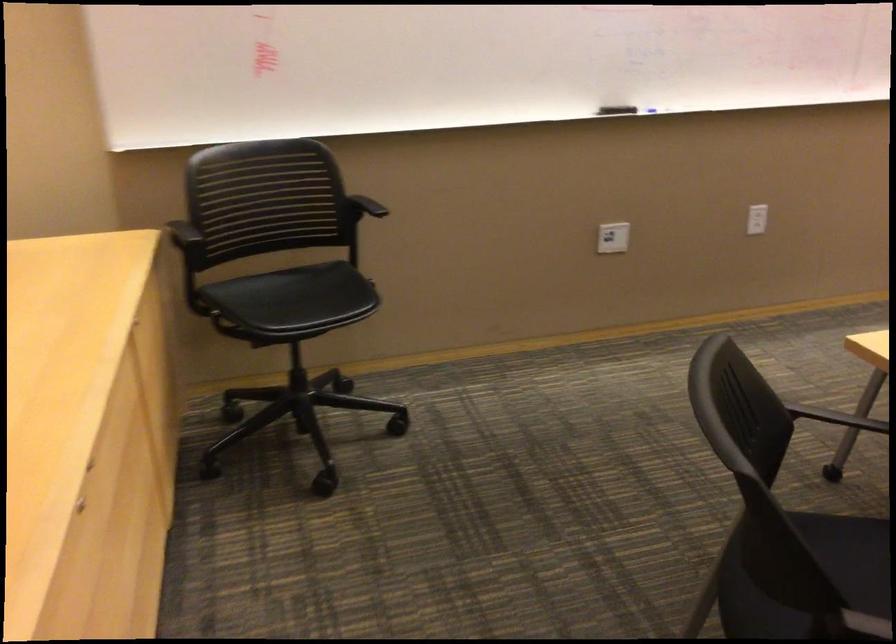
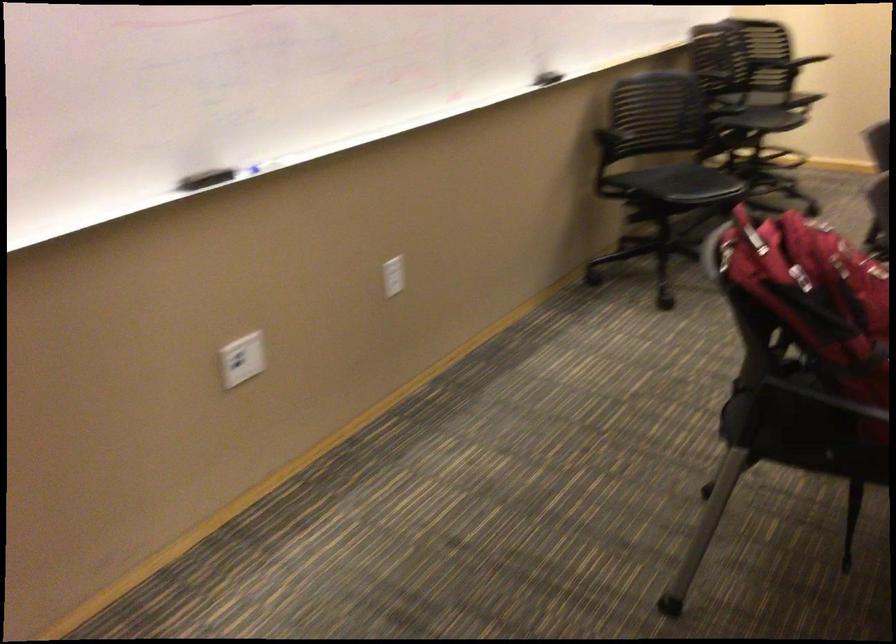
Where in the second image is the point corresponding to pixel 618 106 from the first image?

(204, 178)